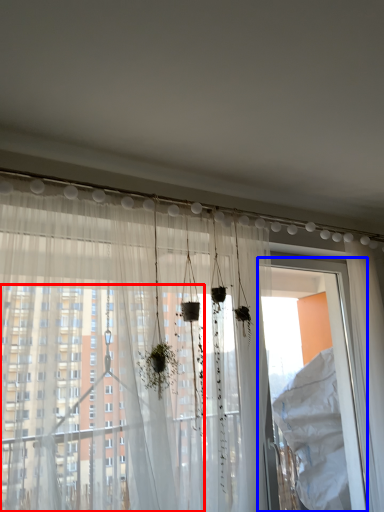
Question: Which point is further to the camera, window (highlighted by a red box) or screen door (highlighted by a blue box)?

Choices:
 (A) window
 (B) screen door

Answer: (B)